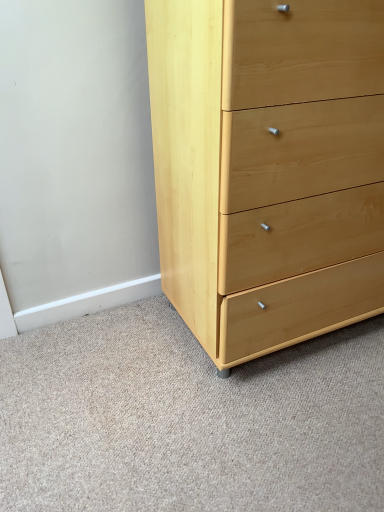
Where is `free space to the left of natural wood chest of drawers at center`? Image resolution: width=384 pixels, height=512 pixels. free space to the left of natural wood chest of drawers at center is located at coordinates (102, 368).